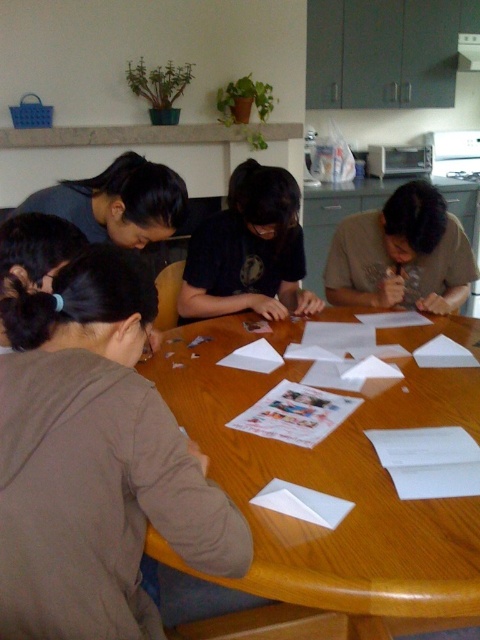
Question: Which object is farther from the camera taking this photo?

Choices:
 (A) brown matte shirt at center
 (B) black matte shirt at center

Answer: (A)

Question: Which point is closer to the camera?

Choices:
 (A) (389, 230)
 (B) (201, 401)

Answer: (B)

Question: Does brown fabric shirt at lower left come behind brown matte shirt at center?

Choices:
 (A) no
 (B) yes

Answer: (A)

Question: Among these objects, which one is nearest to the camera?

Choices:
 (A) wooden table at center
 (B) black matte shirt at center

Answer: (A)

Question: Can you confirm if wooden table at center is positioned to the right of black matte shirt at center?

Choices:
 (A) no
 (B) yes

Answer: (B)

Question: Does brown fabric shirt at lower left appear on the left side of white paper at center?

Choices:
 (A) no
 (B) yes

Answer: (B)